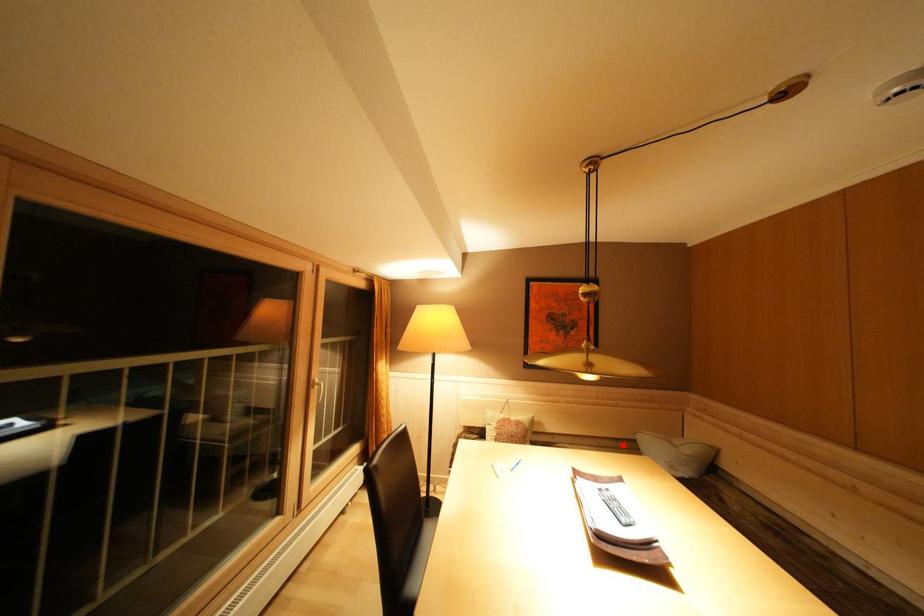
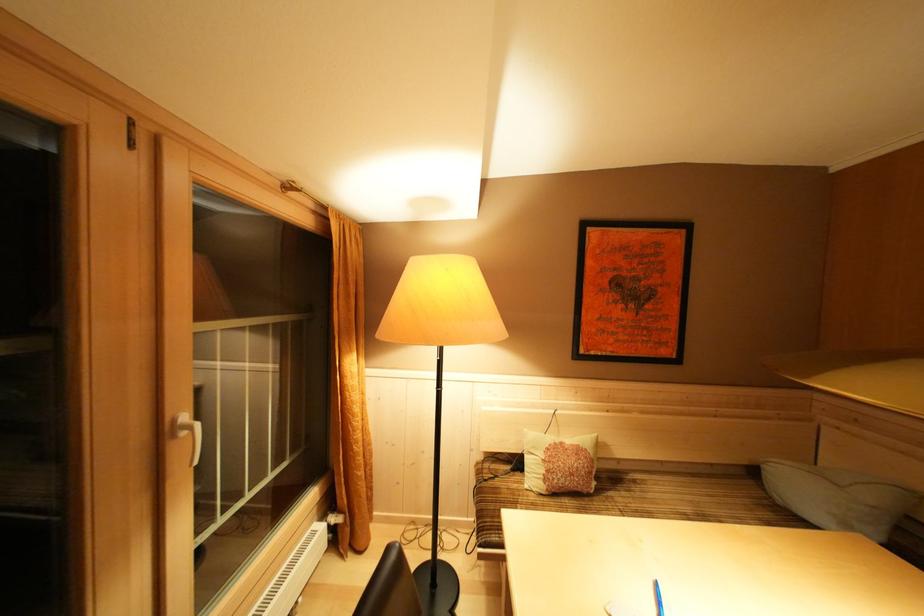
Where in the second image is the point corresponding to the highlighted location from the first image?

(718, 468)